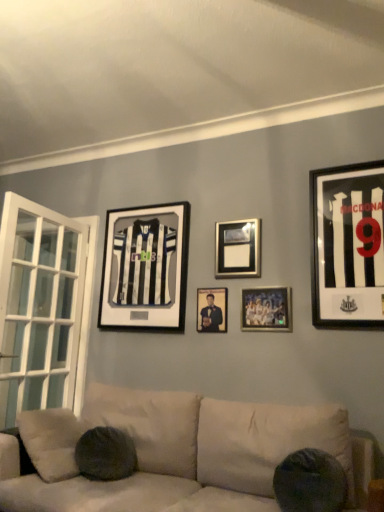
Question: In terms of size, does metallic silver photo frame at center, the fourth picture frame positioned from the left, appear bigger or smaller than metallic silver picture frame at center, acting as the 3th picture frame starting from the right?

Choices:
 (A) big
 (B) small

Answer: (B)

Question: Considering the positions of point (279, 314) and point (228, 231), is point (279, 314) closer or farther from the camera than point (228, 231)?

Choices:
 (A) farther
 (B) closer

Answer: (B)

Question: Which object is positioned farthest from the black and white jersey at upper center, acting as the 5th picture frame starting from the right?

Choices:
 (A) black matte jersey at right, the 5th picture frame in the left-to-right sequence
 (B) matte black portrait at center, marked as the 4th picture frame in a right-to-left arrangement
 (C) metallic silver picture frame at center, acting as the 3th picture frame starting from the right
 (D) metallic silver photo frame at center, the fourth picture frame positioned from the left

Answer: (A)

Question: Estimate the real-world distances between objects in this image. Which object is closer to the metallic silver picture frame at center, acting as the 3th picture frame starting from the right?

Choices:
 (A) black matte jersey at right, the 5th picture frame in the left-to-right sequence
 (B) matte black portrait at center, the second picture frame positioned from the left
 (C) black and white jersey at upper center, acting as the 5th picture frame starting from the right
 (D) metallic silver photo frame at center, positioned as the 2th picture frame in right-to-left order

Answer: (D)